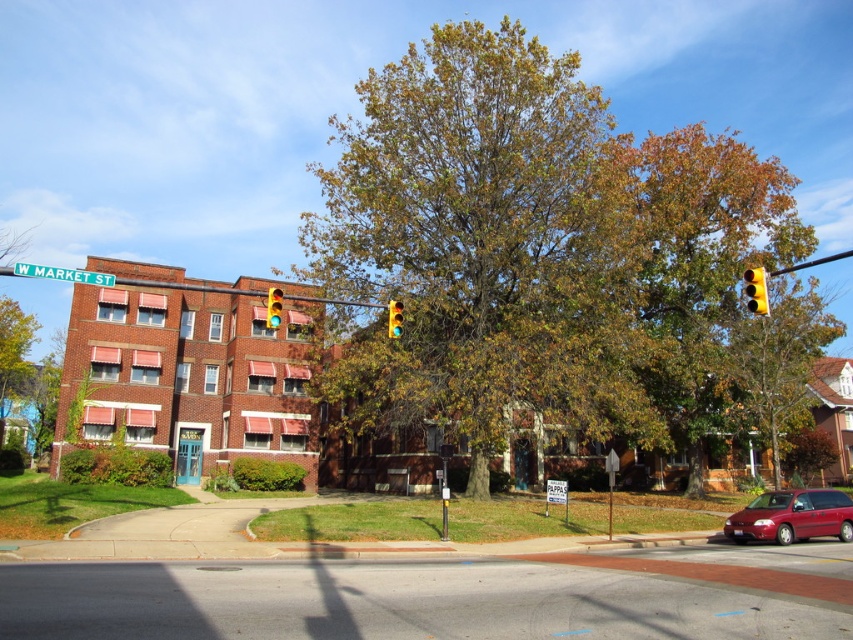
Question: Observing the image, what is the correct spatial positioning of green metallic street sign at upper left in reference to yellow plastic traffic light at upper right?

Choices:
 (A) left
 (B) right

Answer: (A)

Question: Does shiny red minivan at center come behind green metallic street sign at upper left?

Choices:
 (A) no
 (B) yes

Answer: (B)

Question: Estimate the real-world distances between objects in this image. Which object is farther from the green metallic street sign at upper left?

Choices:
 (A) shiny red minivan at center
 (B) yellow glass traffic light at upper center
 (C) yellow plastic traffic light at upper right
 (D) brown textured tree at right

Answer: (D)

Question: Which point is farther from the camera taking this photo?

Choices:
 (A) (463, 81)
 (B) (778, 481)
 (C) (401, 324)
 (D) (799, 518)

Answer: (A)

Question: Based on their relative distances, which object is farther from the yellow glass traffic light at upper center?

Choices:
 (A) green glass traffic light at center
 (B) shiny red minivan at center

Answer: (B)

Question: Does shiny red minivan at center appear under green metallic street sign at upper left?

Choices:
 (A) yes
 (B) no

Answer: (A)